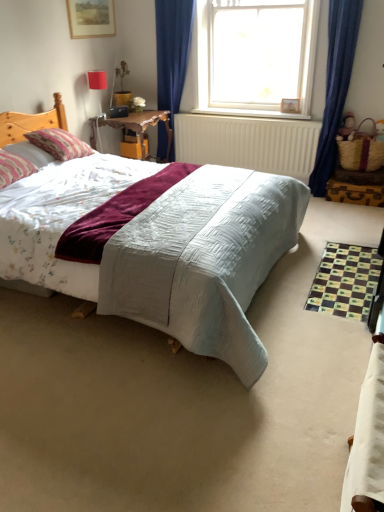
This screenshot has width=384, height=512. What do you see at coordinates (361, 150) in the screenshot?
I see `braided straw picnic basket at right` at bounding box center [361, 150].

Locate an element on the screen. pink striped pillow at left, which is counted as the 1th pillow, starting from the front is located at coordinates (14, 168).

In order to face wooden picture frame at upper left, should I rotate leftwards or rightwards?

Rotate left and turn 12.970 degrees.

The height and width of the screenshot is (512, 384). Describe the element at coordinates (97, 80) in the screenshot. I see `matte red lampshade at upper left` at that location.

Identify the location of braided straw picnic basket at right. (361, 150).

Looking at this image, from the image's perspective, would you say white fabric bed at lower right is positioned over wooden picture frame at upper left?

No, from the image's perspective, white fabric bed at lower right is not on top of wooden picture frame at upper left.

Looking at this image, who is smaller, white fabric bed at lower right or wooden picture frame at upper left?

Smaller between the two is wooden picture frame at upper left.

How different are the orientations of white fabric bed at lower right and wooden picture frame at upper left in degrees?

They differ by 180 degrees in their facing directions.

Considering the sizes of objects white fabric bed at lower right and wooden picture frame at upper left in the image provided, who is wider, white fabric bed at lower right or wooden picture frame at upper left?

white fabric bed at lower right.

Is pink striped pillow at left, which is counted as the 1th pillow, starting from the front, completely or partially outside of white fabric bed at lower right?

Yes, pink striped pillow at left, which is counted as the 1th pillow, starting from the front, is outside of white fabric bed at lower right.

Looking at this image, which of these two, pink striped pillow at left, which is counted as the 2th pillow, starting from the back, or white fabric bed at lower right, stands shorter?

Standing shorter between the two is pink striped pillow at left, which is counted as the 2th pillow, starting from the back.

From a real-world perspective, relative to pink fabric pillow at left, the 2th pillow viewed from the front, is matte red lampshade at upper left vertically above or below?

matte red lampshade at upper left is situated higher than pink fabric pillow at left, the 2th pillow viewed from the front, in the real world.

Do you think matte red lampshade at upper left is within pink fabric pillow at left, the 2th pillow viewed from the front, or outside of it?

matte red lampshade at upper left cannot be found inside pink fabric pillow at left, the 2th pillow viewed from the front.

Considering the sizes of objects wooden table at center and pink fabric pillow at left, the first pillow positioned from the back, in the image provided, who is shorter, wooden table at center or pink fabric pillow at left, the first pillow positioned from the back,?

pink fabric pillow at left, the first pillow positioned from the back, is shorter.

Considering the relative positions of wooden table at center and pink fabric pillow at left, the first pillow positioned from the back, in the image provided, is wooden table at center to the left of pink fabric pillow at left, the first pillow positioned from the back, from the viewer's perspective?

In fact, wooden table at center is to the right of pink fabric pillow at left, the first pillow positioned from the back.

Locate an element on the screen. Image resolution: width=384 pixels, height=512 pixels. the 1st pillow located above the wooden table at center (from a real-world perspective) is located at coordinates (59, 144).

Is wooden table at center next to pink fabric pillow at left, the 2th pillow viewed from the front, and touching it?

No, wooden table at center is not in contact with pink fabric pillow at left, the 2th pillow viewed from the front.

Consider the image. From the image's perspective, is white fabric bed at lower right located above or below transparent glass window at upper center?

white fabric bed at lower right is situated lower than transparent glass window at upper center in the image.

In the scene shown: Is white fabric bed at lower right in contact with transparent glass window at upper center?

No, white fabric bed at lower right is not touching transparent glass window at upper center.

Identify the location of window on the right of white fabric bed at lower right. (255, 56).

Can you confirm if white fabric bed at lower right is positioned to the left of transparent glass window at upper center?

Yes.

How different are the orientations of transparent glass window at upper center and pink striped pillow at left, which is counted as the 1th pillow, starting from the front, in degrees?

96.2 degrees separate the facing orientations of transparent glass window at upper center and pink striped pillow at left, which is counted as the 1th pillow, starting from the front.

Considering the sizes of objects transparent glass window at upper center and pink striped pillow at left, which is counted as the 1th pillow, starting from the front, in the image provided, who is thinner, transparent glass window at upper center or pink striped pillow at left, which is counted as the 1th pillow, starting from the front,?

transparent glass window at upper center is thinner.

Which object is further away from the camera taking this photo, transparent glass window at upper center or pink striped pillow at left, which is counted as the 2th pillow, starting from the back?

transparent glass window at upper center is more distant.

This screenshot has height=512, width=384. In order to click on pillow that is the 1st one below the transparent glass window at upper center (from a real-world perspective) in this screenshot , I will do `click(14, 168)`.

I want to click on picture frame above the pink fabric pillow at left, the first pillow positioned from the back (from the image's perspective), so click(91, 18).

From a real-world perspective, which is physically above, wooden picture frame at upper left or pink fabric pillow at left, the first pillow positioned from the back?

In real-world perspective, wooden picture frame at upper left is above.

Is wooden picture frame at upper left placed right next to pink fabric pillow at left, the 2th pillow viewed from the front?

wooden picture frame at upper left and pink fabric pillow at left, the 2th pillow viewed from the front, are clearly separated.

Considering the relative sizes of wooden picture frame at upper left and pink fabric pillow at left, the 2th pillow viewed from the front, in the image provided, is wooden picture frame at upper left smaller than pink fabric pillow at left, the 2th pillow viewed from the front,?

Yes, wooden picture frame at upper left is smaller than pink fabric pillow at left, the 2th pillow viewed from the front.

What are the coordinates of `bed on the right of wooden picture frame at upper left` in the screenshot? It's located at (368, 437).

Identify the location of bed below the pink striped pillow at left, which is counted as the 1th pillow, starting from the front (from a real-world perspective). (368, 437).

From the picture: Considering their positions, is white fabric bed at lower right positioned further to wooden picture frame at upper left than wooden table at center?

white fabric bed at lower right.

Estimate the real-world distances between objects in this image. Which object is closer to pink fabric pillow at left, the first pillow positioned from the back, white fabric bed at lower right or pink striped pillow at left, which is counted as the 2th pillow, starting from the back?

pink striped pillow at left, which is counted as the 2th pillow, starting from the back.

From the picture: From the image, which object appears to be nearer to white fabric bed at lower right, wooden picture frame at upper left or wooden table at center?

Among the two, wooden table at center is located nearer to white fabric bed at lower right.

From the image, which object appears to be farther from pink fabric pillow at left, the 2th pillow viewed from the front, pink striped pillow at left, which is counted as the 1th pillow, starting from the front, or wooden picture frame at upper left?

The object further to pink fabric pillow at left, the 2th pillow viewed from the front, is wooden picture frame at upper left.

Which object lies nearer to the anchor point wooden table at center, wooden picture frame at upper left or matte red lampshade at upper left?

Based on the image, matte red lampshade at upper left appears to be nearer to wooden table at center.

From the picture: Based on their spatial positions, is braided straw picnic basket at right or transparent glass window at upper center closer to pink fabric pillow at left, the 2th pillow viewed from the front?

transparent glass window at upper center is closer to pink fabric pillow at left, the 2th pillow viewed from the front.

Based on their spatial positions, is pink striped pillow at left, which is counted as the 1th pillow, starting from the front, or wooden table at center further from braided straw picnic basket at right?

pink striped pillow at left, which is counted as the 1th pillow, starting from the front, is positioned further to the anchor braided straw picnic basket at right.

From the image, which object appears to be nearer to pink striped pillow at left, which is counted as the 1th pillow, starting from the front, pink fabric pillow at left, the 2th pillow viewed from the front, or white fabric bed at lower right?

Based on the image, pink fabric pillow at left, the 2th pillow viewed from the front, appears to be nearer to pink striped pillow at left, which is counted as the 1th pillow, starting from the front.

I want to click on table between pink fabric pillow at left, the 2th pillow viewed from the front, and braided straw picnic basket at right, so click(139, 127).

Where is `table situated between wooden picture frame at upper left and transparent glass window at upper center from left to right`? The image size is (384, 512). table situated between wooden picture frame at upper left and transparent glass window at upper center from left to right is located at coordinates point(139,127).

What are the coordinates of `lamp that lies between wooden picture frame at upper left and pink striped pillow at left, which is counted as the 1th pillow, starting from the front, from top to bottom` in the screenshot? It's located at coord(97,80).

The height and width of the screenshot is (512, 384). I want to click on pillow between pink striped pillow at left, which is counted as the 1th pillow, starting from the front, and braided straw picnic basket at right, so (x=59, y=144).